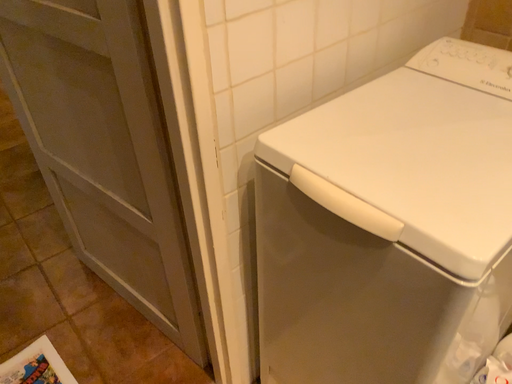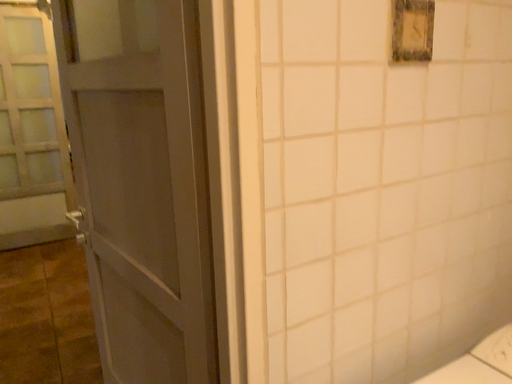
Question: Which way did the camera rotate in the video?

Choices:
 (A) rotated right
 (B) rotated left

Answer: (B)